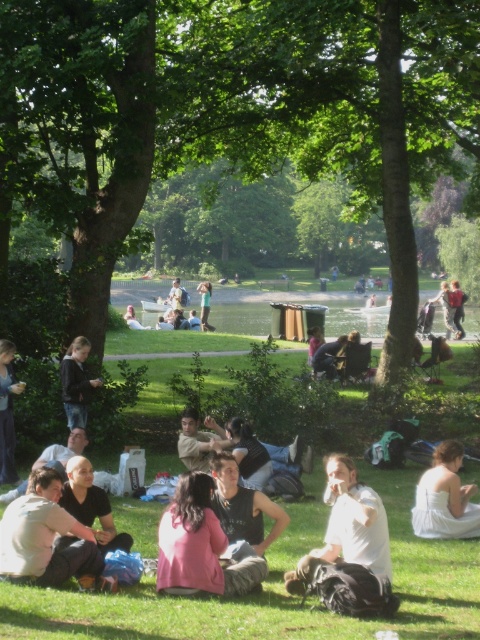
Which is in front, point (85, 390) or point (215, 420)?

Point (85, 390) is more forward.

Is point (76, 352) in front of point (197, 452)?

No, it is behind (197, 452).

Between point (87, 342) and point (217, 444), which one is positioned behind?

The point (87, 342) is more distant.

Image resolution: width=480 pixels, height=640 pixels. Identify the location of dark blue jeans at lower left. (76, 381).

Is the position of white cotton shirt at center less distant than that of matte black jacket at lower left?

Yes, white cotton shirt at center is closer to the viewer.

Is point (361, 557) in front of point (3, 454)?

Yes, point (361, 557) is closer to viewer.

Between point (383, 532) and point (10, 483), which one is positioned in front?

Point (383, 532) is more forward.

You are a GUI agent. You are given a task and a screenshot of the screen. Output one action in this format:
    pyautogui.click(x=<x>, y=<y>)
    Task: Click on the white cotton shirt at center
    
    Given the screenshot: What is the action you would take?
    pyautogui.click(x=347, y=525)

Can you confirm if green leafy tree at center is thinner than dark brown leather jacket at center?

In fact, green leafy tree at center might be wider than dark brown leather jacket at center.

Identify the location of green leafy tree at center. The height and width of the screenshot is (640, 480). (235, 112).

Is point (460, 36) positioned before point (357, 330)?

That is True.

At what (x,y) coordinates should I click in order to perform the action: click on green leafy tree at center. Please return your answer as a coordinate pair (x, y). Image resolution: width=480 pixels, height=640 pixels. Looking at the image, I should click on (235, 112).